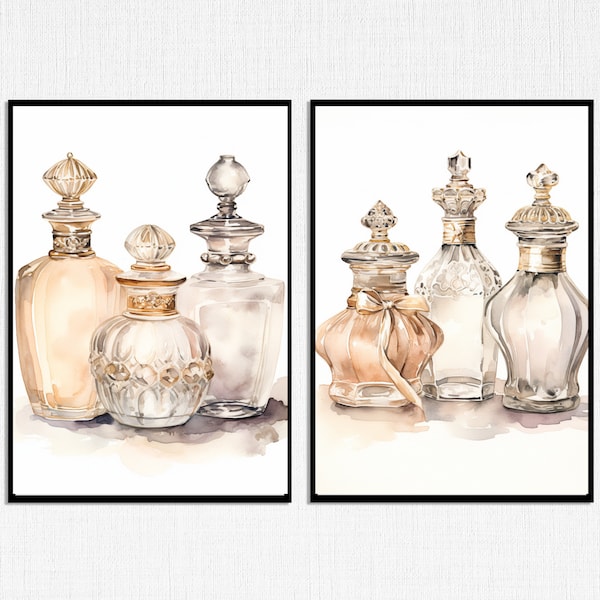
The height and width of the screenshot is (600, 600). I want to click on gold bow round vase, so click(x=371, y=307).